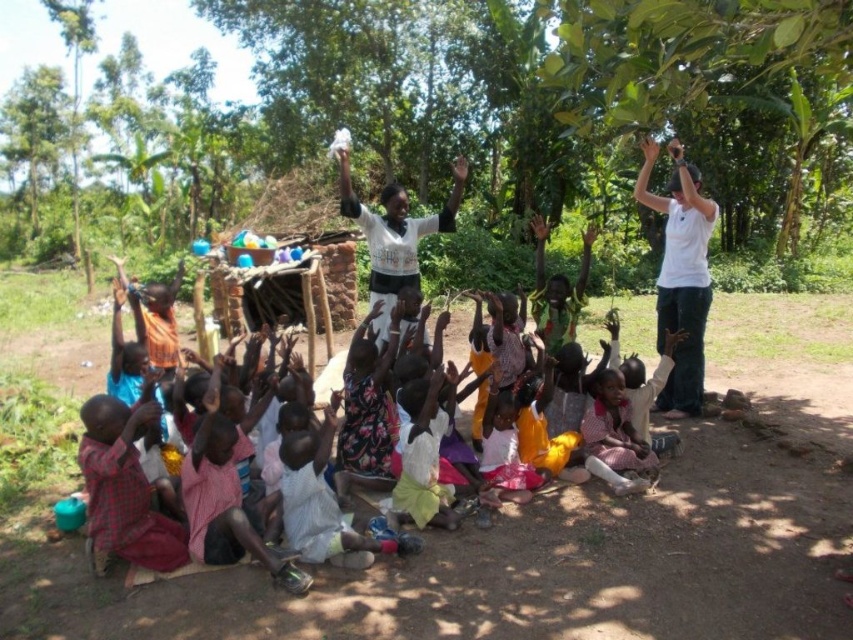
Question: Among these points, which one is farthest from the camera?

Choices:
 (A) (537, 248)
 (B) (410, 257)

Answer: (A)

Question: Based on their relative distances, which object is nearer to the white cotton shirt at center?

Choices:
 (A) green leafy tree at upper center
 (B) white matte shirt at upper right
 (C) brown dirt field at center
 (D) yellow fabric shirt at center

Answer: (D)

Question: Which object appears farthest from the camera in this image?

Choices:
 (A) white cotton shirt at center
 (B) brown dirt field at center
 (C) green leafy tree at upper center
 (D) yellow fabric shirt at center

Answer: (D)

Question: Does white matte shirt at upper right have a smaller size compared to white cotton shirt at center?

Choices:
 (A) yes
 (B) no

Answer: (A)

Question: Does green leafy tree at upper center have a greater width compared to white cotton shirt at center?

Choices:
 (A) yes
 (B) no

Answer: (A)

Question: Where is brown dirt field at center located in relation to white cotton shirt at center in the image?

Choices:
 (A) right
 (B) left

Answer: (A)